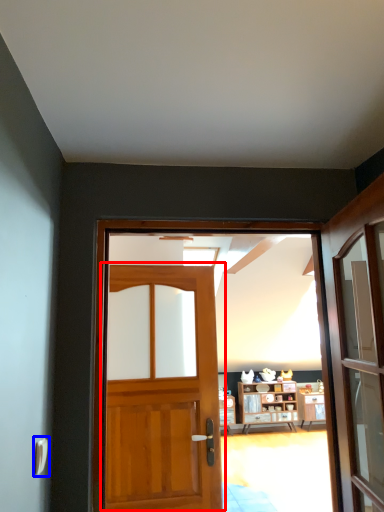
Question: Which object is closer to the camera taking this photo, door (highlighted by a red box) or door handle (highlighted by a blue box)?

Choices:
 (A) door
 (B) door handle

Answer: (B)